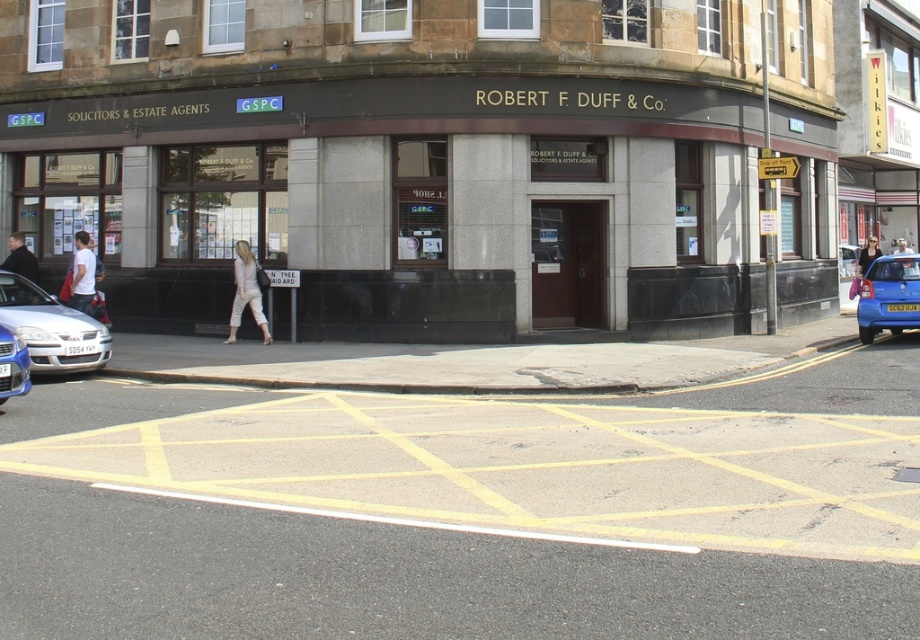
You are a pedestrian standing on the street corner near the Robert F. Duff Co. building. You see a dark blue jacket at left and a light brown leather jacket at upper right. Which jacket is taller?

The dark blue jacket at left is much taller than the light brown leather jacket at upper right.

You are a pedestrian on the street and see both the dark blue jacket at left and the light brown leather jacket at upper right. Which jacket is positioned closer to the left side of the street?

The dark blue jacket at left is positioned closer to the left side of the street compared to the light brown leather jacket at upper right, as it is located to the left of it.